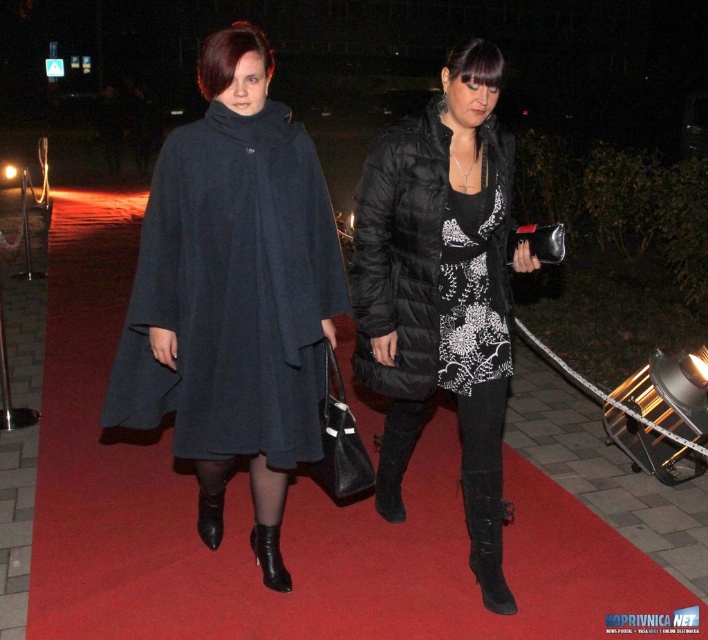
You are a photographer standing behind the two individuals on the red carpet. You need to capture a photo that includes both the black quilted boots at lower center and the black leather boot at lower center. Given the camera you have can only focus on objects within 30 inches of each other, will you be able to get a clear photo of both boots?

The distance between the black quilted boots at lower center and the black leather boot at lower center is 33.09 inches. Since the camera requires objects to be within 30 inches for clear focus, the boots are slightly too far apart. Adjust their positions or use a different camera setting to ensure both are in focus.

You are a photographer at a night event. You want to capture a photo where both the matte black cape at center and the black printed dress at center are visible. Based on their positions, which one would appear lower in the photo?

The matte black cape at center is positioned under the black printed dress at center, so it would appear lower in the photo.

You are a photographer at a night event. You need to capture a photo of both the matte black coat at center and the black printed dress at center. Since the camera can only focus on one subject at a time, which one should you choose to ensure the full length of the clothing is visible in the frame?

The matte black coat at center is much taller than the black printed dress at center, so you should focus on the matte black coat at center to ensure its full length is visible in the frame.